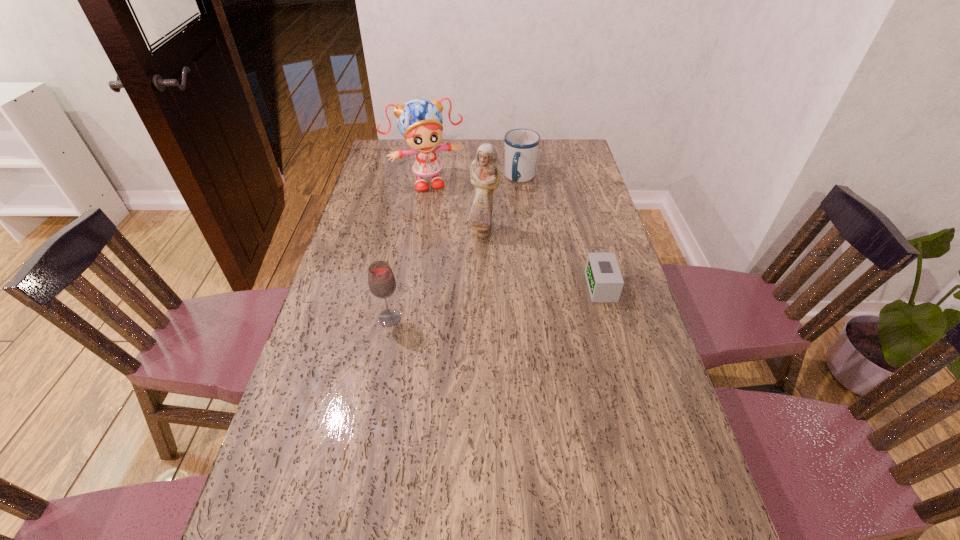
Find the location of a particular element. vacant region that satisfies the following two spatial constraints: 1. on the front side of the mug; 2. on the front-facing side of the alarm clock is located at coordinates click(x=534, y=287).

Where is `free location that satisfies the following two spatial constraints: 1. on the back side of the second nearest object; 2. on the front-facing side of the glass drink container`? This screenshot has width=960, height=540. free location that satisfies the following two spatial constraints: 1. on the back side of the second nearest object; 2. on the front-facing side of the glass drink container is located at coordinates (396, 287).

At what (x,y) coordinates should I click in order to perform the action: click on free location that satisfies the following two spatial constraints: 1. on the back side of the glass drink container; 2. on the right side of the figurine. Please return your answer as a coordinate pair (x, y). The height and width of the screenshot is (540, 960). Looking at the image, I should click on (406, 232).

The image size is (960, 540). What are the coordinates of `vacant area that satisfies the following two spatial constraints: 1. on the back side of the doll; 2. on the right side of the nearest object` in the screenshot? It's located at (416, 181).